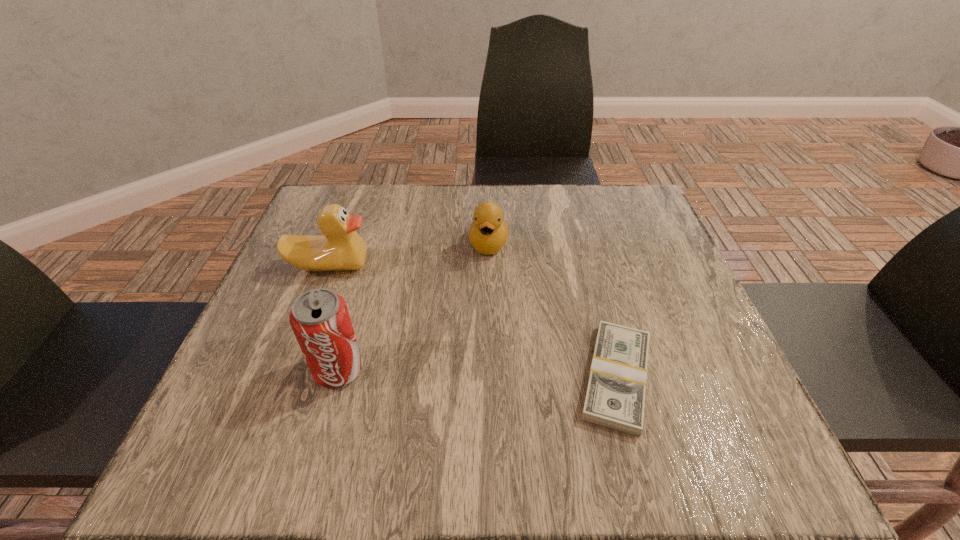
Identify the location of object present at the near left corner. Image resolution: width=960 pixels, height=540 pixels. (319, 318).

In order to click on object at the near right corner in this screenshot , I will do `click(615, 397)`.

I want to click on vacant position at the far edge of the desktop, so tap(444, 185).

This screenshot has height=540, width=960. What are the coordinates of `vacant space at the near edge of the desktop` in the screenshot? It's located at (416, 413).

What are the coordinates of `free space at the left edge` in the screenshot? It's located at (314, 275).

Locate an element on the screen. vacant space at the right edge of the desktop is located at coordinates (622, 240).

Where is `vacant space at the far left corner`? The height and width of the screenshot is (540, 960). vacant space at the far left corner is located at coordinates (300, 226).

Identify the location of free location at the near left corner. (278, 396).

I want to click on vacant region at the near right corner of the desktop, so pyautogui.click(x=645, y=390).

Where is `vacant area between the second object from right to left and the rightmost object`? vacant area between the second object from right to left and the rightmost object is located at coordinates (553, 310).